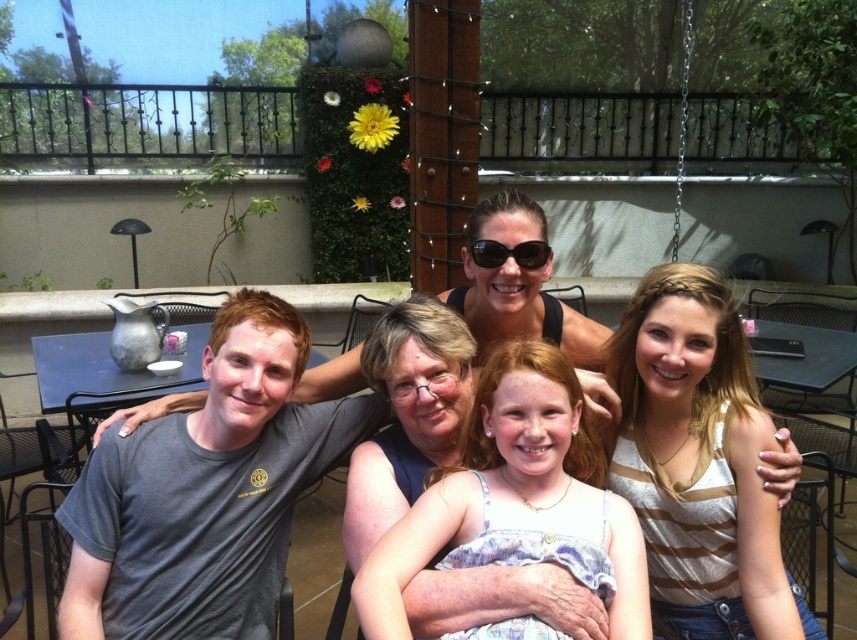
Question: Among these objects, which one is nearest to the camera?

Choices:
 (A) light blue denim dress at center
 (B) gray cotton t-shirt at left
 (C) black plastic sunglasses at center

Answer: (A)

Question: Which object is the closest to the gray cotton t-shirt at left?

Choices:
 (A) black plastic sunglasses at center
 (B) striped cotton shirt at center

Answer: (A)

Question: From the image, what is the correct spatial relationship of gray cotton t-shirt at left in relation to light blue denim dress at center?

Choices:
 (A) left
 (B) right

Answer: (A)

Question: Observing the image, what is the correct spatial positioning of striped cotton shirt at center in reference to black plastic sunglasses at center?

Choices:
 (A) left
 (B) right

Answer: (B)

Question: Among these points, which one is nearest to the camera?

Choices:
 (A) (231, 321)
 (B) (496, 358)
 (C) (639, 461)

Answer: (B)

Question: Is striped cotton shirt at center further to camera compared to light blue denim dress at center?

Choices:
 (A) yes
 (B) no

Answer: (A)